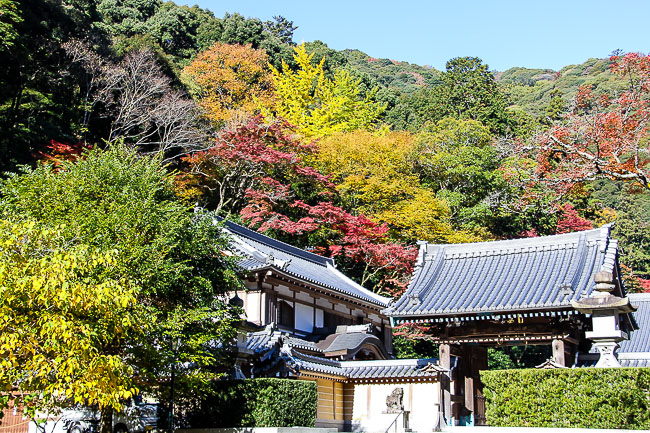
Identify the location of window. This screenshot has height=433, width=650. (287, 314).